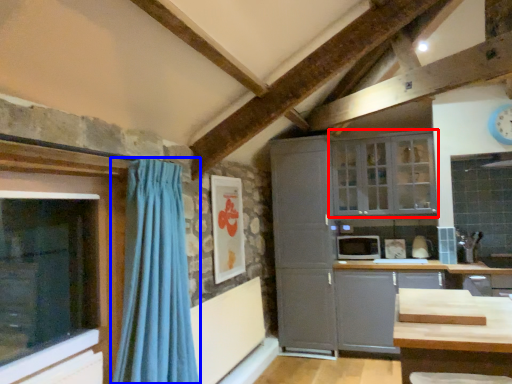
Question: Which point is closer to the camera, window (highlighted by a red box) or curtain (highlighted by a blue box)?

Choices:
 (A) window
 (B) curtain

Answer: (B)